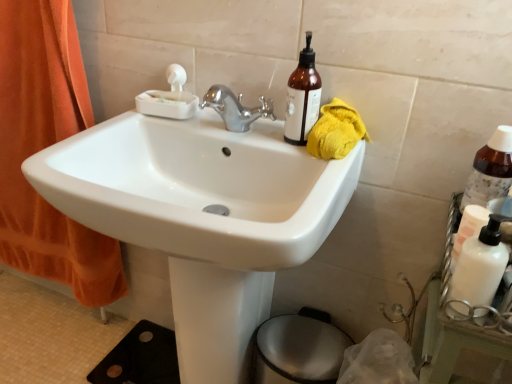
Question: Can you confirm if yellow cloth at upper right is positioned to the right of translucent amber bottle at upper right, the second bottle from the bottom?

Choices:
 (A) yes
 (B) no

Answer: (A)

Question: Is translucent amber bottle at upper right, marked as the 1th bottle in a left-to-right arrangement, surrounded by yellow cloth at upper right?

Choices:
 (A) yes
 (B) no

Answer: (B)

Question: From the image's perspective, is yellow cloth at upper right above translucent amber bottle at upper right, marked as the 1th bottle in a left-to-right arrangement?

Choices:
 (A) yes
 (B) no

Answer: (B)

Question: From a real-world perspective, is yellow cloth at upper right physically above translucent amber bottle at upper right, marked as the 1th bottle in a left-to-right arrangement?

Choices:
 (A) yes
 (B) no

Answer: (B)

Question: Considering the relative sizes of yellow cloth at upper right and translucent amber bottle at upper right, marked as the 1th bottle in a left-to-right arrangement, in the image provided, is yellow cloth at upper right bigger than translucent amber bottle at upper right, marked as the 1th bottle in a left-to-right arrangement,?

Choices:
 (A) no
 (B) yes

Answer: (B)

Question: Does point (451, 251) appear closer or farther from the camera than point (478, 162)?

Choices:
 (A) farther
 (B) closer

Answer: (B)

Question: From a real-world perspective, is white matte bottle at right positioned above or below translucent amber bottle at right, arranged as the 2th bottle when viewed from the left?

Choices:
 (A) below
 (B) above

Answer: (A)

Question: In the image, is white matte bottle at right positioned in front of or behind translucent amber bottle at right, acting as the 2th bottle starting from the top?

Choices:
 (A) behind
 (B) front

Answer: (B)

Question: In terms of height, does white matte bottle at right look taller or shorter compared to translucent amber bottle at right, acting as the 2th bottle starting from the top?

Choices:
 (A) short
 (B) tall

Answer: (A)

Question: In terms of width, does metallic silver bidet at lower center look wider or thinner when compared to yellow cloth at upper right?

Choices:
 (A) thin
 (B) wide

Answer: (B)

Question: Is point (297, 380) positioned closer to the camera than point (337, 145)?

Choices:
 (A) farther
 (B) closer

Answer: (A)

Question: Is metallic silver bidet at lower center inside the boundaries of yellow cloth at upper right, or outside?

Choices:
 (A) inside
 (B) outside

Answer: (B)

Question: From a real-world perspective, relative to yellow cloth at upper right, is metallic silver bidet at lower center vertically above or below?

Choices:
 (A) above
 (B) below

Answer: (B)

Question: Relative to metallic silver bidet at lower center, is translucent amber bottle at upper right, the first bottle in the top-to-bottom sequence, in front or behind?

Choices:
 (A) behind
 (B) front

Answer: (B)

Question: From the image's perspective, is translucent amber bottle at upper right, the first bottle in the top-to-bottom sequence, above or below metallic silver bidet at lower center?

Choices:
 (A) above
 (B) below

Answer: (A)